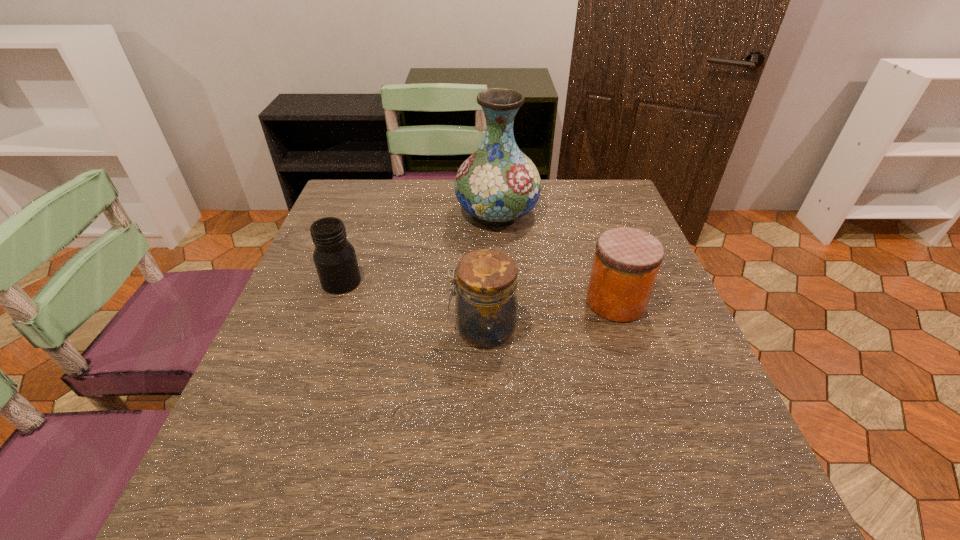
Select which jar appears as the closest to the leftmost object. Please provide its 2D coordinates. Your answer should be formatted as a tuple, i.e. [(x, y)], where the tuple contains the x and y coordinates of a point satisfying the conditions above.

[(486, 283)]

Identify the location of vacant area in the image that satisfies the following two spatial constraints: 1. on the front side of the rightmost object; 2. on the lid of the second jar from right to left. Image resolution: width=960 pixels, height=540 pixels. (624, 328).

Locate an element on the screen. The height and width of the screenshot is (540, 960). vacant region that satisfies the following two spatial constraints: 1. on the front side of the tallest object; 2. on the lid of the second jar from right to left is located at coordinates (503, 328).